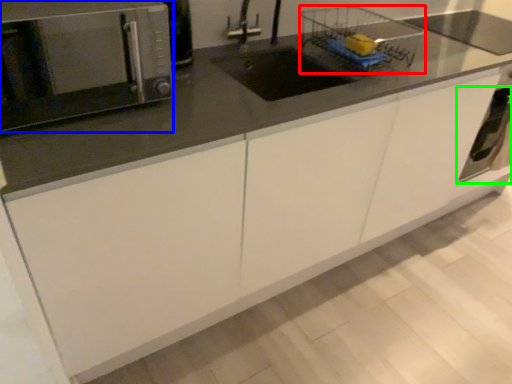
Question: Which is nearer to the basket (highlighted by a red box)? microwave oven (highlighted by a blue box) or oven (highlighted by a green box).

Choices:
 (A) microwave oven
 (B) oven

Answer: (B)